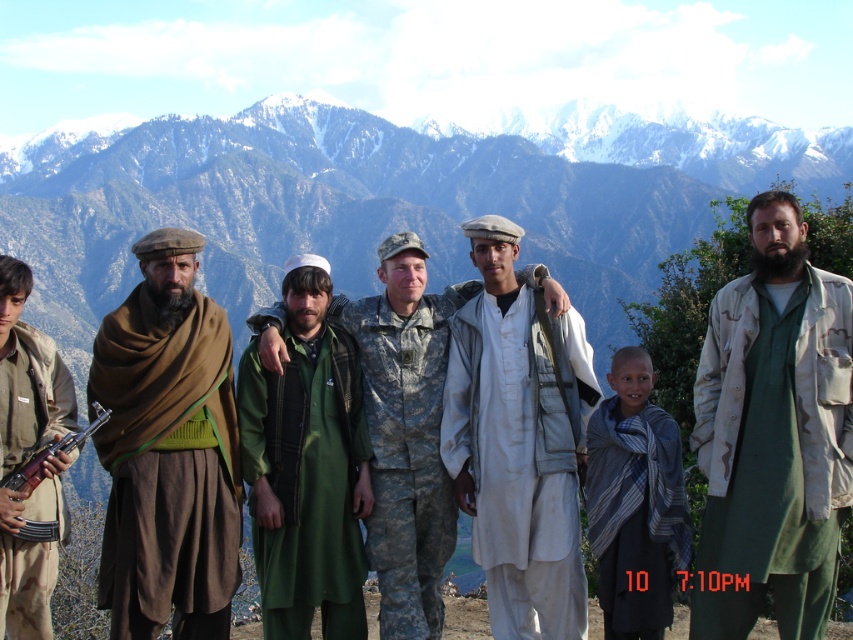
Question: Estimate the real-world distances between objects in this image. Which object is farther from the brown woolen shawl at left?

Choices:
 (A) snowy rock mountain range at upper center
 (B) white cotton shirt at center
 (C) green fabric at center
 (D) green cotton robe at right

Answer: (A)

Question: Among these points, which one is farthest from the camera?

Choices:
 (A) (322, 540)
 (B) (601, 282)
 (C) (74, 452)

Answer: (B)

Question: Where is green cotton robe at right located in relation to white cotton shirt at center in the image?

Choices:
 (A) below
 (B) above

Answer: (B)

Question: Which point is closer to the camera taking this photo?

Choices:
 (A) (471, 352)
 (B) (260, 577)

Answer: (B)

Question: Does green cotton robe at right appear on the left side of brown cotton shirt at left?

Choices:
 (A) yes
 (B) no

Answer: (B)

Question: Can you confirm if white cotton shirt at center is positioned to the right of green fabric at center?

Choices:
 (A) no
 (B) yes

Answer: (B)